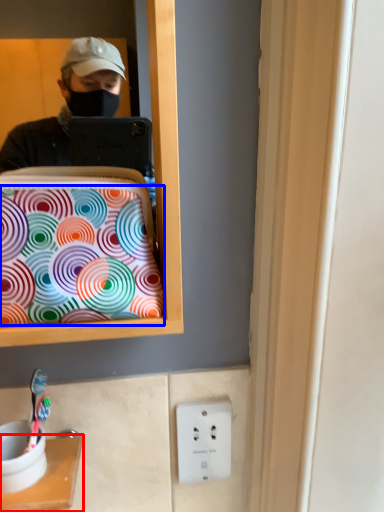
Question: Which point is further to the camera, furniture (highlighted by a red box) or pattern (highlighted by a blue box)?

Choices:
 (A) furniture
 (B) pattern

Answer: (A)